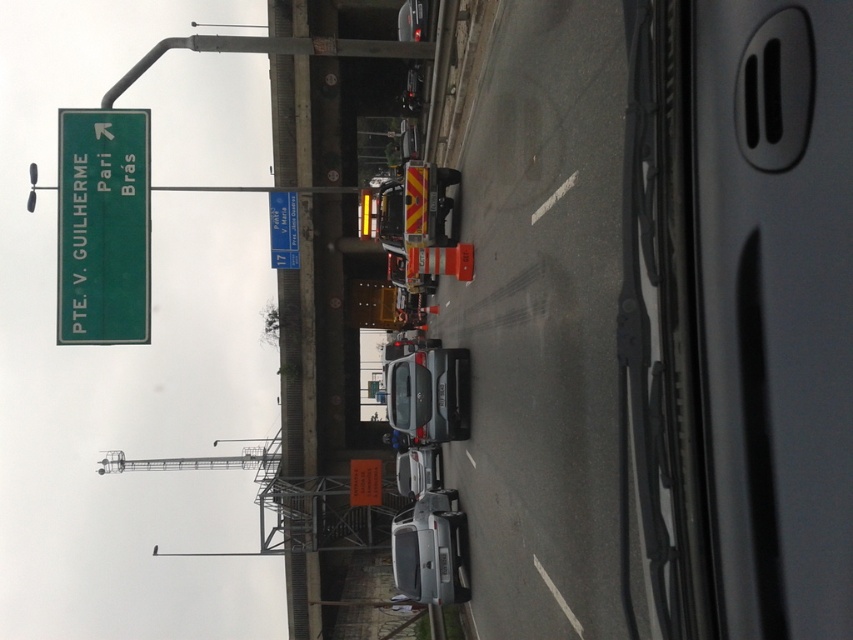
Question: Can you confirm if green matte sign at upper left is positioned to the left of blue plastic road sign at center?

Choices:
 (A) yes
 (B) no

Answer: (A)

Question: Is the position of green matte sign at upper left more distant than that of blue plastic road sign at center?

Choices:
 (A) no
 (B) yes

Answer: (A)

Question: Which point is farther to the camera?

Choices:
 (A) green matte sign at upper left
 (B) blue plastic road sign at center

Answer: (B)

Question: Which point is farther to the camera?

Choices:
 (A) (444, 561)
 (B) (288, 230)
 (C) (61, 195)

Answer: (B)

Question: Among these points, which one is farthest from the camera?

Choices:
 (A) (412, 582)
 (B) (294, 252)
 (C) (134, 337)

Answer: (B)

Question: Is green matte sign at upper left thinner than blue plastic road sign at center?

Choices:
 (A) no
 (B) yes

Answer: (A)